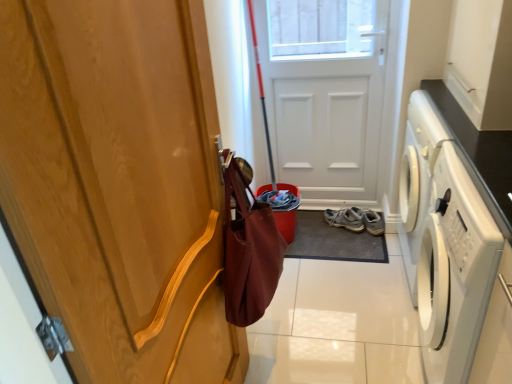
Locate an element on the screen. vacant space situated above dark gray rubber doormat at center (from a real-world perspective) is located at coordinates (333, 236).